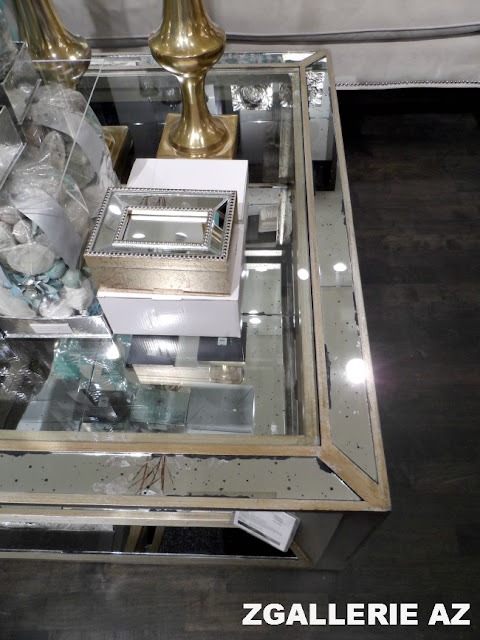
The width and height of the screenshot is (480, 640). Find the location of `floor`. floor is located at coordinates (456, 392).